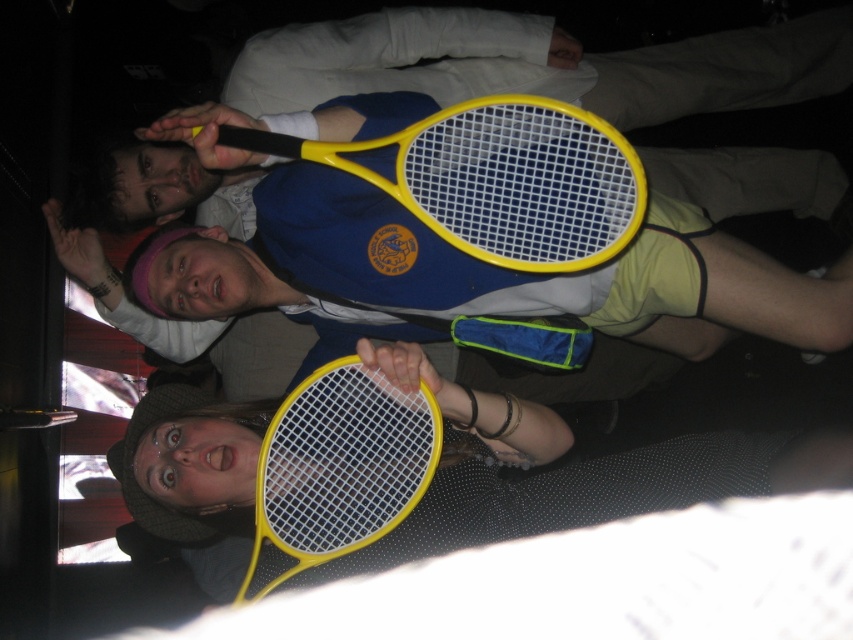
Is yellow plastic racket at upper center positioned before yellow plastic racket at lower center?

That is True.

Does yellow plastic racket at upper center have a lesser height compared to yellow plastic racket at lower center?

Correct, yellow plastic racket at upper center is not as tall as yellow plastic racket at lower center.

Find the location of a particular element. The image size is (853, 640). yellow plastic racket at upper center is located at coordinates (496, 179).